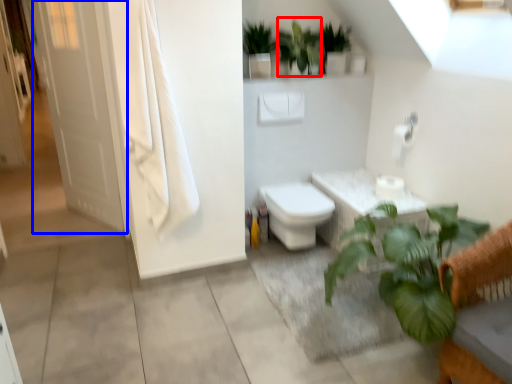
Question: Which of the following is the farthest to the observer, vegetation (highlighted by a red box) or screen door (highlighted by a blue box)?

Choices:
 (A) vegetation
 (B) screen door

Answer: (B)